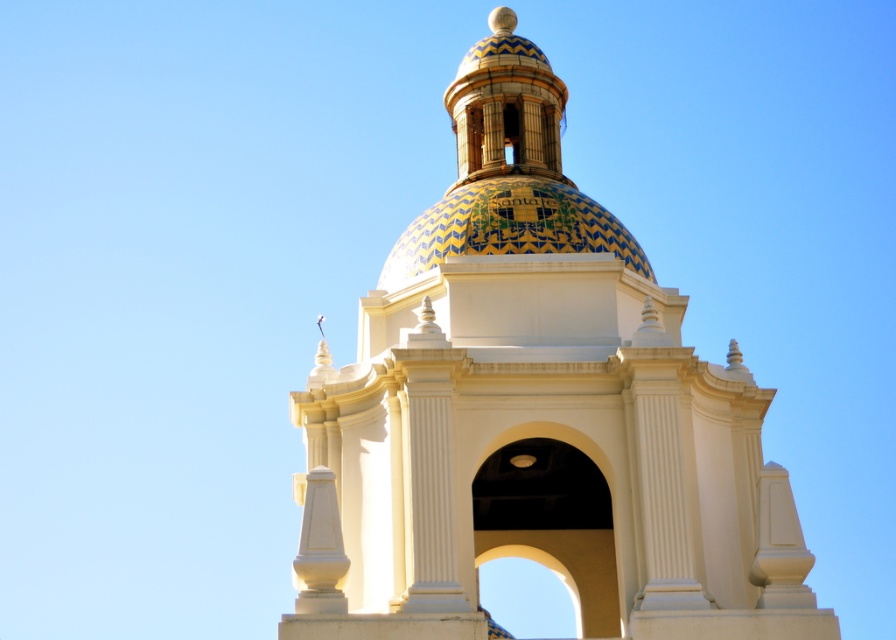
Question: Does white ceramic dome at center appear over glazed ceramic dome at center?

Choices:
 (A) no
 (B) yes

Answer: (A)

Question: Among these points, which one is nearest to the camera?

Choices:
 (A) (505, 44)
 (B) (509, 157)

Answer: (B)

Question: Which of the following is the farthest from the observer?

Choices:
 (A) (539, 104)
 (B) (481, 202)

Answer: (A)

Question: Does white ceramic dome at center appear on the left side of glazed ceramic dome at center?

Choices:
 (A) yes
 (B) no

Answer: (B)

Question: Can you confirm if white ceramic dome at center is smaller than glazed ceramic dome at center?

Choices:
 (A) no
 (B) yes

Answer: (B)